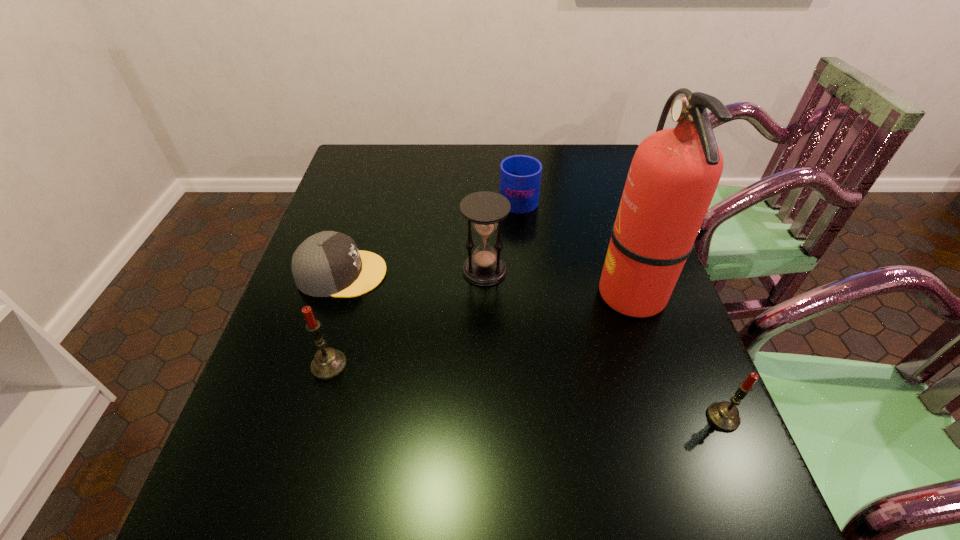
Identify the location of free space located on the left of the nearer candle. This screenshot has width=960, height=540. (619, 417).

Identify the location of vacant point located 0.110m on the side with the handle of the mug. [515, 164].

Where is `free spot located 0.080m on the side with the handle of the mug`? This screenshot has height=540, width=960. free spot located 0.080m on the side with the handle of the mug is located at coordinates (516, 169).

The width and height of the screenshot is (960, 540). In order to click on vacant space situated on the side with the handle of the mug in this screenshot , I will do `click(514, 156)`.

This screenshot has height=540, width=960. What are the coordinates of `vacant region located 0.120m on the side of the fire extinguisher with the nozzle and handle` in the screenshot? It's located at (548, 293).

In order to click on free location located on the side of the fire extinguisher with the nozzle and handle in this screenshot , I will do `click(499, 293)`.

Where is `blank space located 0.140m on the side of the fire extinguisher with the nozzle and handle`? The width and height of the screenshot is (960, 540). blank space located 0.140m on the side of the fire extinguisher with the nozzle and handle is located at coordinates (540, 293).

Locate an element on the screen. blank space located on the front-facing side of the cap is located at coordinates (526, 273).

This screenshot has width=960, height=540. In order to click on vacant space located on the right of the hourglass in this screenshot , I will do `click(562, 270)`.

I want to click on object that is at the near edge, so click(x=724, y=415).